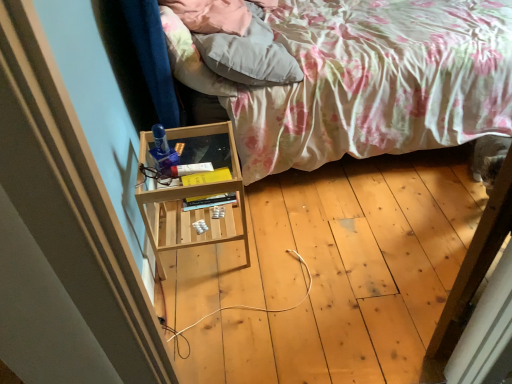
Question: Is floral fabric bed at center with fluffy white pillow at upper center?

Choices:
 (A) yes
 (B) no

Answer: (B)

Question: Can you confirm if floral fabric bed at center is shorter than fluffy white pillow at upper center?

Choices:
 (A) yes
 (B) no

Answer: (B)

Question: Are floral fabric bed at center and fluffy white pillow at upper center far apart?

Choices:
 (A) no
 (B) yes

Answer: (A)

Question: Considering the relative positions of floral fabric bed at center and fluffy white pillow at upper center in the image provided, is floral fabric bed at center to the right of fluffy white pillow at upper center from the viewer's perspective?

Choices:
 (A) no
 (B) yes

Answer: (B)

Question: Considering the relative sizes of floral fabric bed at center and fluffy white pillow at upper center in the image provided, is floral fabric bed at center wider than fluffy white pillow at upper center?

Choices:
 (A) yes
 (B) no

Answer: (A)

Question: From a real-world perspective, does floral fabric bed at center sit lower than fluffy white pillow at upper center?

Choices:
 (A) yes
 (B) no

Answer: (A)

Question: Does fluffy white pillow at upper center appear on the left side of floral fabric bed at center?

Choices:
 (A) no
 (B) yes

Answer: (B)

Question: Does fluffy white pillow at upper center have a greater height compared to floral fabric bed at center?

Choices:
 (A) yes
 (B) no

Answer: (B)

Question: Is fluffy white pillow at upper center bigger than floral fabric bed at center?

Choices:
 (A) no
 (B) yes

Answer: (A)

Question: Is fluffy white pillow at upper center facing away from floral fabric bed at center?

Choices:
 (A) no
 (B) yes

Answer: (B)

Question: Considering the relative positions of fluffy white pillow at upper center and floral fabric bed at center in the image provided, is fluffy white pillow at upper center in front of floral fabric bed at center?

Choices:
 (A) yes
 (B) no

Answer: (B)

Question: Can you confirm if fluffy white pillow at upper center is shorter than floral fabric bed at center?

Choices:
 (A) yes
 (B) no

Answer: (A)

Question: Is point (455, 97) closer or farther from the camera than point (260, 76)?

Choices:
 (A) farther
 (B) closer

Answer: (A)